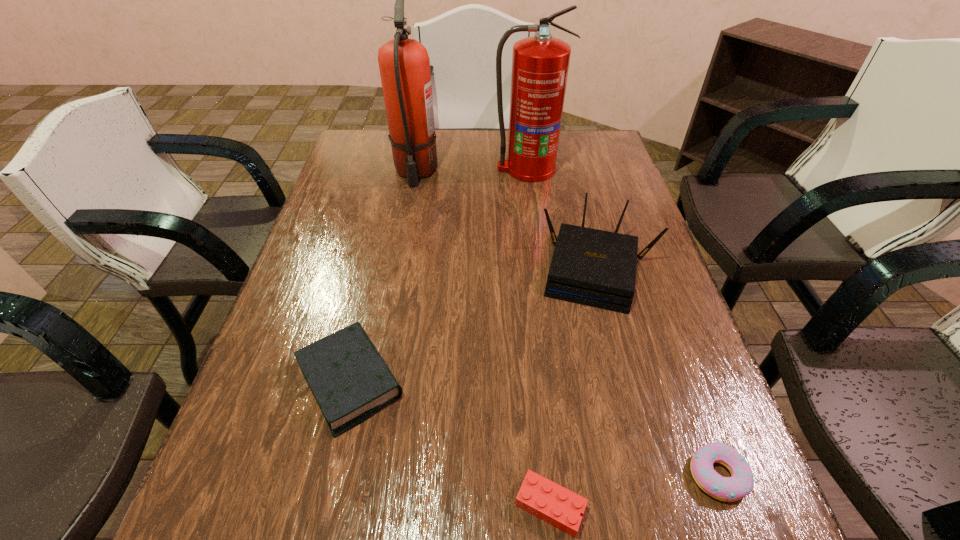
Find the location of a particular element. the left fire extinguisher is located at coordinates (404, 64).

I want to click on the right fire extinguisher, so click(540, 63).

At what (x,y) coordinates should I click in order to perform the action: click on router. Please return your answer as a coordinate pair (x, y). Looking at the image, I should click on (597, 268).

This screenshot has height=540, width=960. Find the location of `the third tallest object`. the third tallest object is located at coordinates (597, 268).

Identify the location of the fourth tallest object. (349, 379).

The height and width of the screenshot is (540, 960). I want to click on Bible, so click(x=349, y=379).

What are the coordinates of `Lego` in the screenshot? It's located at (x=539, y=496).

Image resolution: width=960 pixels, height=540 pixels. In order to click on doughnut in this screenshot , I will do `click(729, 489)`.

The image size is (960, 540). I want to click on free location located on the nozzle of the left fire extinguisher, so [402, 241].

Where is `free space located on the instruction side of the right fire extinguisher`? This screenshot has height=540, width=960. free space located on the instruction side of the right fire extinguisher is located at coordinates point(535,228).